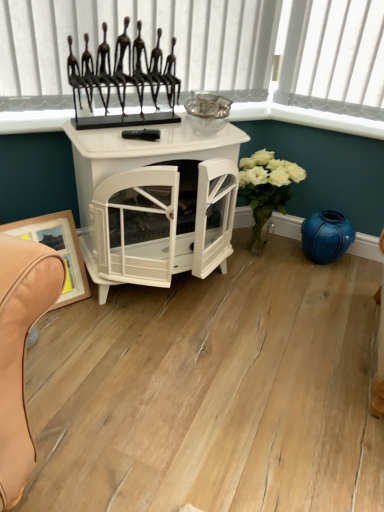
I want to click on free point in front of blue glossy vase at lower right, so click(334, 282).